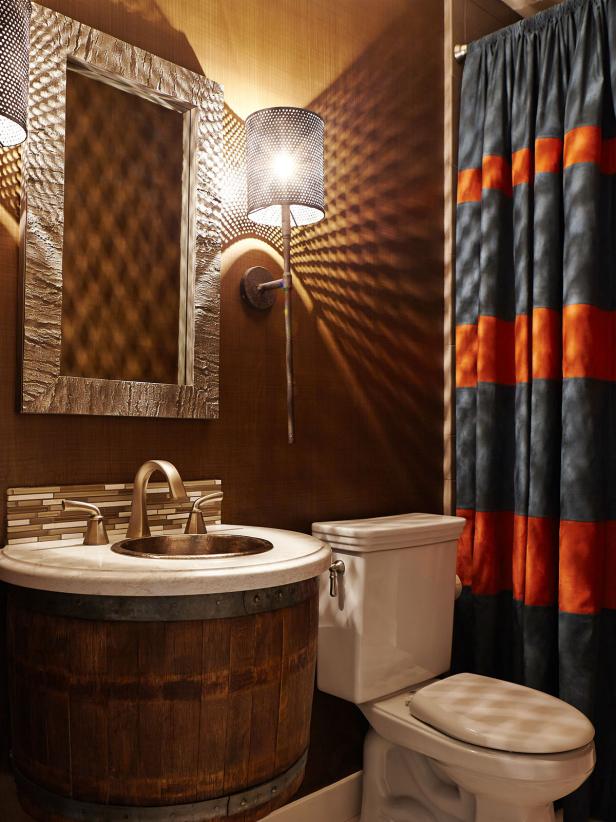
Identify the location of sink. (204, 542).